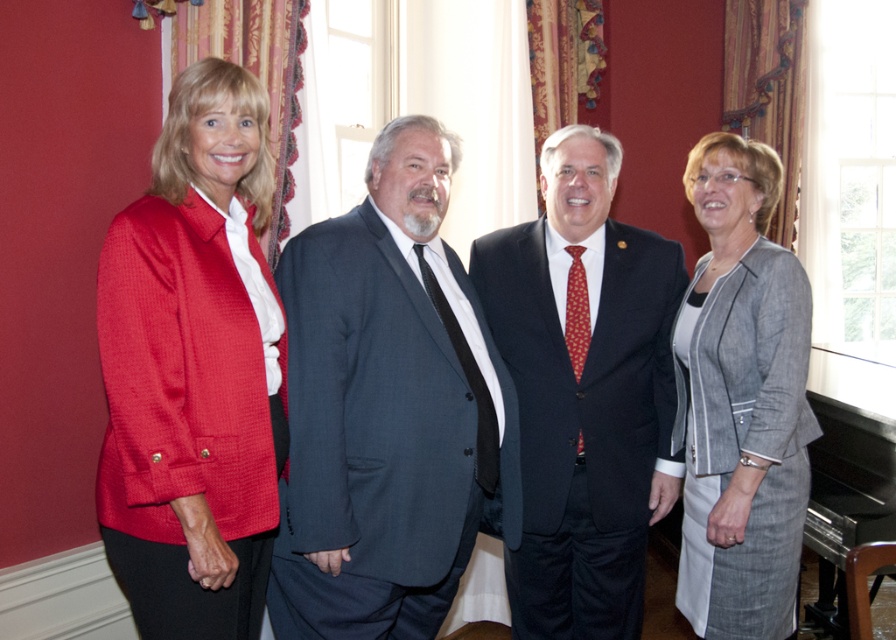
Question: Is dark gray suit at center smaller than dark blue suit at center?

Choices:
 (A) no
 (B) yes

Answer: (A)

Question: Can you confirm if dark blue suit at center is positioned above gray textured blazer at right?

Choices:
 (A) no
 (B) yes

Answer: (A)

Question: Which object is positioned farthest from the matte red blazer at left?

Choices:
 (A) gray textured blazer at right
 (B) dark gray suit at center
 (C) dark blue suit at center

Answer: (A)

Question: Estimate the real-world distances between objects in this image. Which object is closer to the matte red blazer at left?

Choices:
 (A) dark blue suit at center
 (B) dark gray suit at center
 (C) gray textured blazer at right

Answer: (B)

Question: Which point is farther to the camera?

Choices:
 (A) (696, 593)
 (B) (408, 436)

Answer: (A)

Question: Is dark gray suit at center to the right of gray textured blazer at right from the viewer's perspective?

Choices:
 (A) no
 (B) yes

Answer: (A)